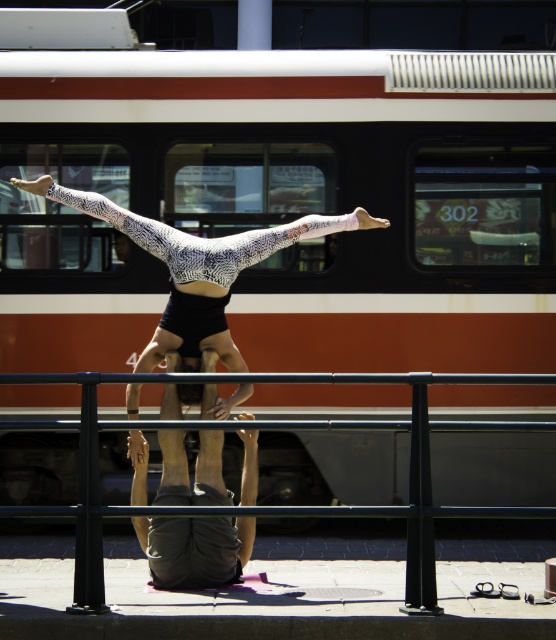
Question: Among these objects, which one is nearest to the camera?

Choices:
 (A) white textured leotard at center
 (B) brown/white striped train at upper center
 (C) dark gray fabric pants at center

Answer: (A)

Question: Can you confirm if brown/white striped train at upper center is positioned to the right of white textured leotard at center?

Choices:
 (A) no
 (B) yes

Answer: (B)

Question: Can you confirm if black metal rail at center is positioned to the left of dark gray fabric pants at center?

Choices:
 (A) no
 (B) yes

Answer: (A)

Question: Which is nearer to the white textured leotard at center?

Choices:
 (A) dark gray fabric pants at center
 (B) black metal rail at center

Answer: (A)

Question: Which point is farther to the camera?

Choices:
 (A) brown/white striped train at upper center
 (B) black metal rail at center

Answer: (A)

Question: Is black metal rail at center in front of dark gray fabric pants at center?

Choices:
 (A) no
 (B) yes

Answer: (B)